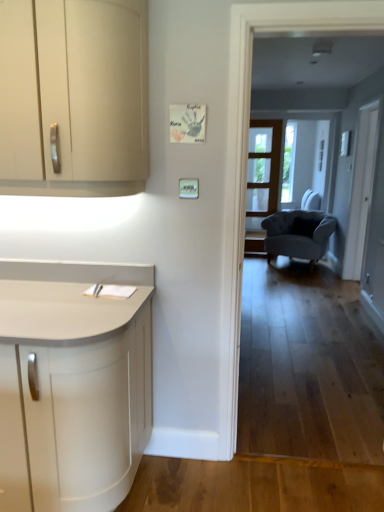
You are a GUI agent. You are given a task and a screenshot of the screen. Output one action in this format:
    pyautogui.click(x=<x>, y=<y>)
    Task: Click on the velvet blue armchair at center
    This screenshot has height=512, width=384.
    Given the screenshot: What is the action you would take?
    pyautogui.click(x=298, y=234)

The height and width of the screenshot is (512, 384). What do you see at coordinates (361, 188) in the screenshot? I see `white glass screen door at right, which appears as the first screen door when viewed from the front` at bounding box center [361, 188].

At what (x,y) coordinates should I click in order to perform the action: click on velvet blue armchair at center. Please return your answer as a coordinate pair (x, y). The image size is (384, 512). Looking at the image, I should click on (298, 234).

Which is in front, clear glass screen door at center, the second screen door positioned from the front, or velvet blue armchair at center?

Positioned in front is velvet blue armchair at center.

Considering the sizes of clear glass screen door at center, marked as the 2th screen door in a right-to-left arrangement, and velvet blue armchair at center in the image, is clear glass screen door at center, marked as the 2th screen door in a right-to-left arrangement, wider or thinner than velvet blue armchair at center?

clear glass screen door at center, marked as the 2th screen door in a right-to-left arrangement, is thinner than velvet blue armchair at center.

Can you tell me how much clear glass screen door at center, which ranks as the 1th screen door in back-to-front order, and velvet blue armchair at center differ in facing direction?

The facing directions of clear glass screen door at center, which ranks as the 1th screen door in back-to-front order, and velvet blue armchair at center are 27.3 degrees apart.

Is point (18, 20) farther from viewer compared to point (294, 254)?

No, it is in front of (294, 254).

Identify the location of cabinetry that appears on the left of velvet blue armchair at center. The width and height of the screenshot is (384, 512). (74, 96).

Is matte cream cabinet at left not close to velvet blue armchair at center?

Indeed, matte cream cabinet at left is not near velvet blue armchair at center.

Between matte cream cabinet at left and velvet blue armchair at center, which one has smaller width?

Thinner between the two is matte cream cabinet at left.

Image resolution: width=384 pixels, height=512 pixels. I want to click on cabinetry lying in front of the clear glass screen door at center, marked as the 2th screen door in a right-to-left arrangement, so click(74, 96).

Is clear glass screen door at center, the second screen door positioned from the front, facing away from matte cream cabinet at left?

No, matte cream cabinet at left is not at the back of clear glass screen door at center, the second screen door positioned from the front.

Considering the relative sizes of clear glass screen door at center, marked as the 2th screen door in a right-to-left arrangement, and matte cream cabinet at left in the image provided, is clear glass screen door at center, marked as the 2th screen door in a right-to-left arrangement, bigger than matte cream cabinet at left?

Incorrect, clear glass screen door at center, marked as the 2th screen door in a right-to-left arrangement, is not larger than matte cream cabinet at left.

Considering the positions of point (251, 213) and point (113, 56), is point (251, 213) closer or farther from the camera than point (113, 56)?

Point (251, 213) is farther from the camera than point (113, 56).

From the picture: Does velvet blue armchair at center turn towards matte cream cabinet at left?

Yes.

Does velvet blue armchair at center have a smaller size compared to matte cream cabinet at left?

No.

Does point (288, 247) appear closer or farther from the camera than point (130, 34)?

Point (288, 247) is farther from the camera than point (130, 34).

Which of these two, white glass screen door at right, marked as the 2th screen door in a left-to-right arrangement, or clear glass screen door at center, which ranks as the 1th screen door in back-to-front order, stands taller?

white glass screen door at right, marked as the 2th screen door in a left-to-right arrangement, is taller.

Measure the distance between white glass screen door at right, the 2th screen door positioned from the back, and clear glass screen door at center, marked as the 2th screen door in a right-to-left arrangement.

The distance of white glass screen door at right, the 2th screen door positioned from the back, from clear glass screen door at center, marked as the 2th screen door in a right-to-left arrangement, is 6.03 feet.

From the image's perspective, between white glass screen door at right, marked as the 2th screen door in a left-to-right arrangement, and clear glass screen door at center, positioned as the first screen door in left-to-right order, who is located below?

white glass screen door at right, marked as the 2th screen door in a left-to-right arrangement, is shown below in the image.

Image resolution: width=384 pixels, height=512 pixels. What are the coordinates of `chair below the white glass screen door at right, which appears as the first screen door when viewed from the front (from the image's perspective)` in the screenshot? It's located at [x=298, y=234].

Based on the photo, how different are the orientations of white glass screen door at right, marked as the 2th screen door in a left-to-right arrangement, and velvet blue armchair at center in degrees?

white glass screen door at right, marked as the 2th screen door in a left-to-right arrangement, and velvet blue armchair at center are facing 62 degrees away from each other.

Are white glass screen door at right, arranged as the 1th screen door when viewed from the right, and velvet blue armchair at center beside each other?

white glass screen door at right, arranged as the 1th screen door when viewed from the right, and velvet blue armchair at center are clearly separated.

Who is shorter, white glass screen door at right, marked as the 2th screen door in a left-to-right arrangement, or velvet blue armchair at center?

velvet blue armchair at center is shorter.

From the image's perspective, which one is positioned lower, clear glass screen door at center, which ranks as the 1th screen door in back-to-front order, or white glass screen door at right, arranged as the 1th screen door when viewed from the right?

From the image's view, white glass screen door at right, arranged as the 1th screen door when viewed from the right, is below.

Based on the photo, considering the sizes of clear glass screen door at center, the second screen door positioned from the front, and white glass screen door at right, arranged as the 1th screen door when viewed from the right, in the image, is clear glass screen door at center, the second screen door positioned from the front, taller or shorter than white glass screen door at right, arranged as the 1th screen door when viewed from the right,?

Considering their sizes, clear glass screen door at center, the second screen door positioned from the front, has less height than white glass screen door at right, arranged as the 1th screen door when viewed from the right.

Is clear glass screen door at center, marked as the 2th screen door in a right-to-left arrangement, positioned beyond the bounds of white glass screen door at right, the 2th screen door positioned from the back?

Yes, clear glass screen door at center, marked as the 2th screen door in a right-to-left arrangement, is not within white glass screen door at right, the 2th screen door positioned from the back.

Image resolution: width=384 pixels, height=512 pixels. What are the coordinates of `chair lying on the right of clear glass screen door at center, the second screen door positioned from the front` in the screenshot? It's located at (298, 234).

Identify the location of cabinetry above the velvet blue armchair at center (from a real-world perspective). (74, 96).

When comparing their distances from velvet blue armchair at center, does white glass screen door at right, arranged as the 1th screen door when viewed from the right, or clear glass screen door at center, which ranks as the 1th screen door in back-to-front order, seem closer?

Among the two, clear glass screen door at center, which ranks as the 1th screen door in back-to-front order, is located nearer to velvet blue armchair at center.

When comparing their distances from clear glass screen door at center, positioned as the first screen door in left-to-right order, does white glass screen door at right, the 2th screen door positioned from the back, or matte cream cabinet at left seem further?

Based on the image, matte cream cabinet at left appears to be further to clear glass screen door at center, positioned as the first screen door in left-to-right order.

Which object lies further to the anchor point white glass screen door at right, arranged as the 1th screen door when viewed from the right, clear glass screen door at center, marked as the 2th screen door in a right-to-left arrangement, or velvet blue armchair at center?

Among the two, clear glass screen door at center, marked as the 2th screen door in a right-to-left arrangement, is located further to white glass screen door at right, arranged as the 1th screen door when viewed from the right.

Looking at the image, which one is located closer to clear glass screen door at center, marked as the 2th screen door in a right-to-left arrangement, white glass screen door at right, which appears as the first screen door when viewed from the front, or velvet blue armchair at center?

Among the two, velvet blue armchair at center is located nearer to clear glass screen door at center, marked as the 2th screen door in a right-to-left arrangement.

Which object lies nearer to the anchor point velvet blue armchair at center, clear glass screen door at center, the second screen door positioned from the front, or matte cream cabinet at left?

clear glass screen door at center, the second screen door positioned from the front, is positioned closer to the anchor velvet blue armchair at center.

From the image, which object appears to be farther from white glass screen door at right, which appears as the first screen door when viewed from the front, velvet blue armchair at center or clear glass screen door at center, which ranks as the 1th screen door in back-to-front order?

clear glass screen door at center, which ranks as the 1th screen door in back-to-front order, is further to white glass screen door at right, which appears as the first screen door when viewed from the front.

In the scene shown: Considering their positions, is white glass screen door at right, the 2th screen door positioned from the back, positioned further to matte cream cabinet at left than clear glass screen door at center, which ranks as the 1th screen door in back-to-front order?

Based on the image, clear glass screen door at center, which ranks as the 1th screen door in back-to-front order, appears to be further to matte cream cabinet at left.

Looking at the image, which one is located further to velvet blue armchair at center, white glass screen door at right, the 2th screen door positioned from the back, or matte cream cabinet at left?

Based on the image, matte cream cabinet at left appears to be further to velvet blue armchair at center.

Find the location of `screen door between matte cream cabinet at left and clear glass screen door at center, marked as the 2th screen door in a right-to-left arrangement, from front to back`. screen door between matte cream cabinet at left and clear glass screen door at center, marked as the 2th screen door in a right-to-left arrangement, from front to back is located at coordinates (361, 188).

Where is `chair located between matte cream cabinet at left and clear glass screen door at center, positioned as the first screen door in left-to-right order, in the depth direction`? This screenshot has height=512, width=384. chair located between matte cream cabinet at left and clear glass screen door at center, positioned as the first screen door in left-to-right order, in the depth direction is located at coordinates (298, 234).

This screenshot has height=512, width=384. Find the location of `screen door between matte cream cabinet at left and velvet blue armchair at center in the front-back direction`. screen door between matte cream cabinet at left and velvet blue armchair at center in the front-back direction is located at coordinates (361, 188).

Image resolution: width=384 pixels, height=512 pixels. Find the location of `chair between white glass screen door at right, marked as the 2th screen door in a left-to-right arrangement, and clear glass screen door at center, the second screen door positioned from the front, along the z-axis`. chair between white glass screen door at right, marked as the 2th screen door in a left-to-right arrangement, and clear glass screen door at center, the second screen door positioned from the front, along the z-axis is located at coordinates (298, 234).